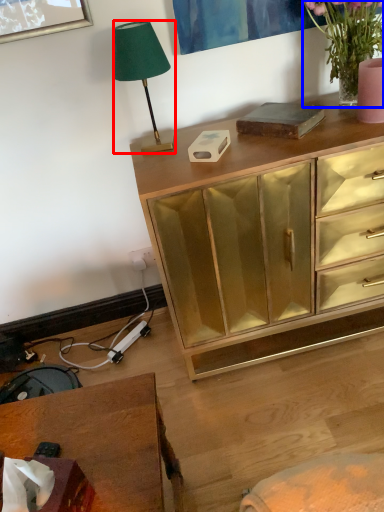
Question: Which point is closer to the camera, lamp (highlighted by a red box) or houseplant (highlighted by a blue box)?

Choices:
 (A) lamp
 (B) houseplant

Answer: (B)